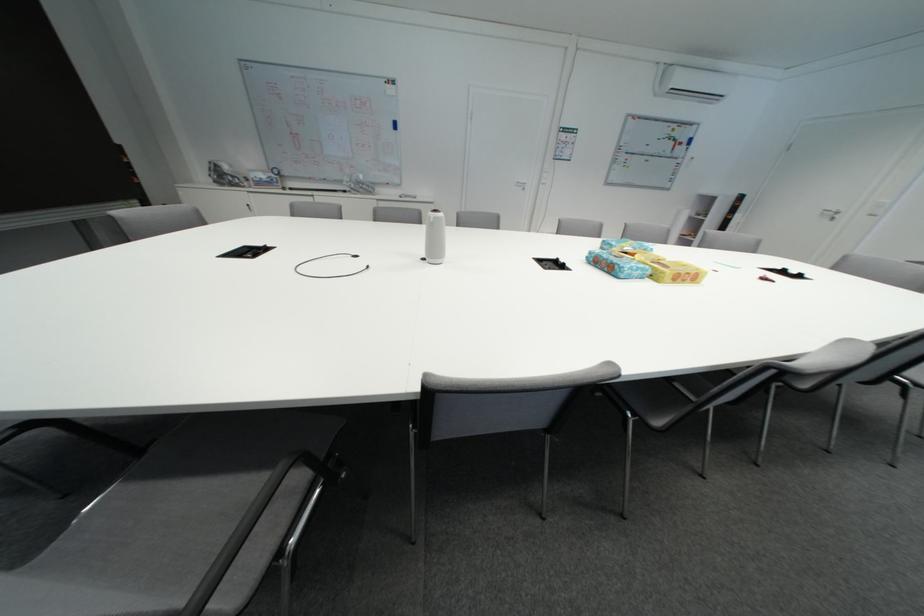
The location [551,264] corresponds to which object?

It refers to a black marker.